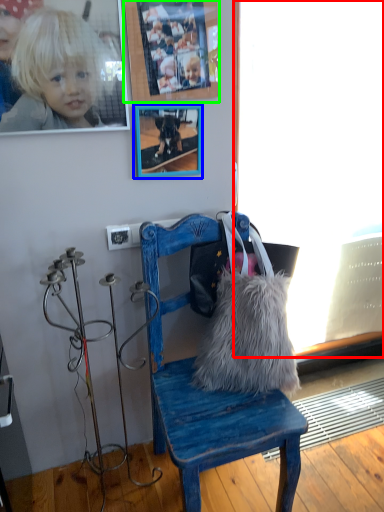
Question: Which object is the closest to the window screen (highlighted by a red box)? Choose among these: picture frame (highlighted by a blue box) or picture frame (highlighted by a green box).

Choices:
 (A) picture frame
 (B) picture frame

Answer: (B)